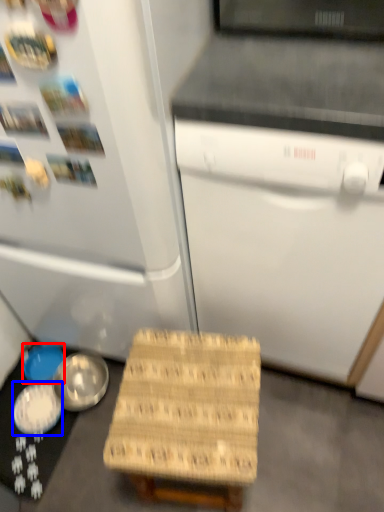
Question: Among these objects, which one is farthest to the camera, bowl (highlighted by a red box) or bowl (highlighted by a blue box)?

Choices:
 (A) bowl
 (B) bowl

Answer: (A)